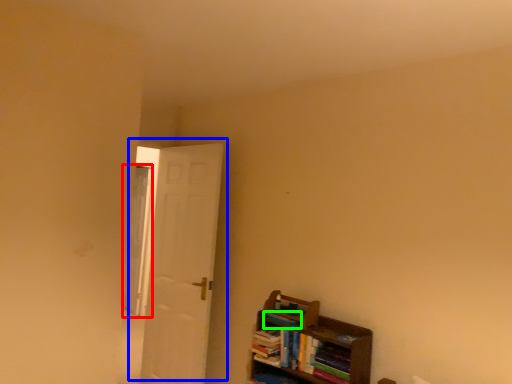
Question: Based on their relative distances, which object is nearer to window (highlighted by a red box)? Choose from door (highlighted by a blue box) and book (highlighted by a green box).

Choices:
 (A) door
 (B) book

Answer: (A)